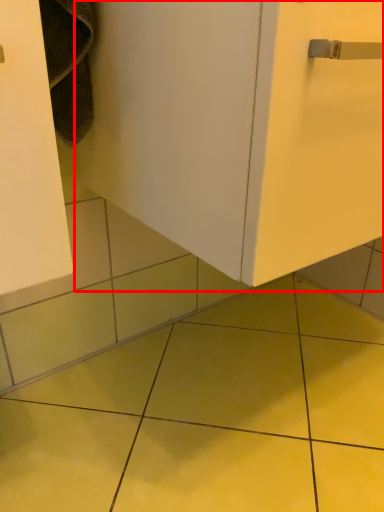
Question: In this image, where is door (annotated by the red box) located relative to ceramic tile?

Choices:
 (A) right
 (B) left

Answer: (A)